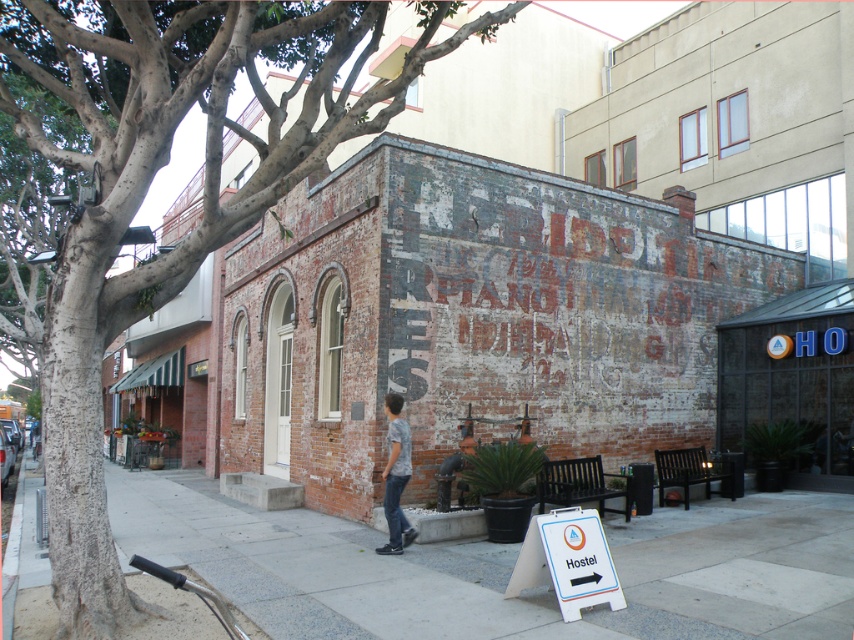
From the picture: Can you confirm if white plastic sign at lower right is positioned to the right of camouflage shirt at center?

Yes, white plastic sign at lower right is to the right of camouflage shirt at center.

Between white plastic sign at lower right and camouflage shirt at center, which one appears on the left side from the viewer's perspective?

Positioned to the left is camouflage shirt at center.

Where is `white plastic sign at lower right`? white plastic sign at lower right is located at coordinates (566, 561).

This screenshot has height=640, width=854. I want to click on white plastic sign at lower right, so click(566, 561).

Which is more to the right, smooth bark tree at left or white plastic sign at lower right?

Positioned to the right is white plastic sign at lower right.

From the picture: Can you confirm if smooth bark tree at left is bigger than white plastic sign at lower right?

Indeed, smooth bark tree at left has a larger size compared to white plastic sign at lower right.

Measure the distance between point (314, 83) and camera.

Point (314, 83) and camera are 22.72 feet apart.

Locate an element on the screen. The height and width of the screenshot is (640, 854). smooth bark tree at left is located at coordinates (151, 177).

Who is lower down, smooth bark tree at left or blue glass sign at center?

blue glass sign at center

Between smooth bark tree at left and blue glass sign at center, which one has less height?

blue glass sign at center is shorter.

Describe the element at coordinates (151, 177) in the screenshot. I see `smooth bark tree at left` at that location.

This screenshot has height=640, width=854. Identify the location of smooth bark tree at left. (151, 177).